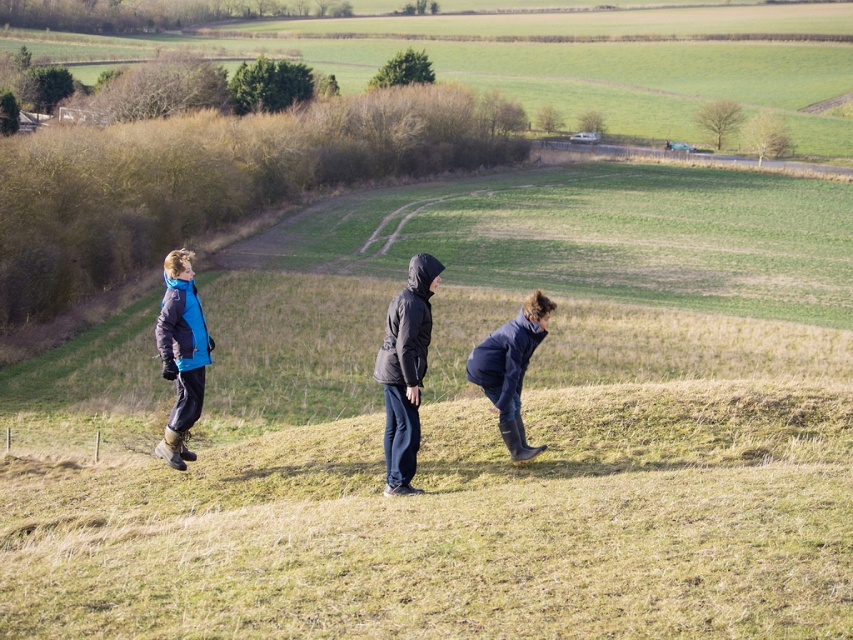
You are a photographer trying to capture a group photo of the three people on the hillside. You want to ensure that the matte blue jacket at left and the dark blue rubber boots at center are both clearly visible in the frame. Given their sizes, which object should you focus on to ensure both are in focus?

The matte blue jacket at left is smaller in size compared to the dark blue rubber boots at center. To ensure both are in focus, focus on the larger object, the dark blue rubber boots at center, as it will help maintain depth of field for the smaller matte blue jacket at left.

You are a photographer trying to frame a shot of the matte blue jacket at left in the image. What are the coordinates of the jacket to ensure proper focus?

The coordinates of the matte blue jacket at left are at point [181,353].

You are a photographer positioned at the bottom of the hill. You need to take a photo of the black quilted jacket at center. According to the coordinates, where should you aim your camera?

The black quilted jacket at center is located at coordinates point (405, 371), so you should aim your camera towards that point to capture it.